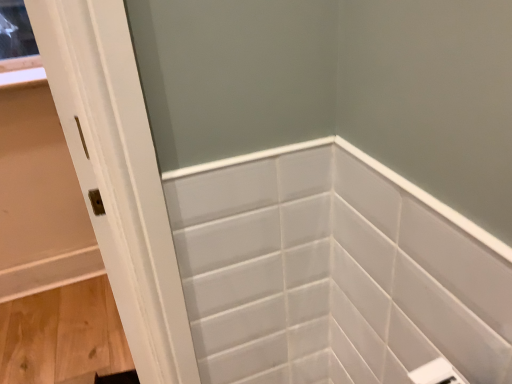
Describe the element at coordinates (333, 272) in the screenshot. I see `white glossy tile at center` at that location.

This screenshot has width=512, height=384. In order to click on white glossy tile at center in this screenshot , I will do `click(333, 272)`.

Identify the location of white glossy tile at center. pyautogui.click(x=333, y=272).